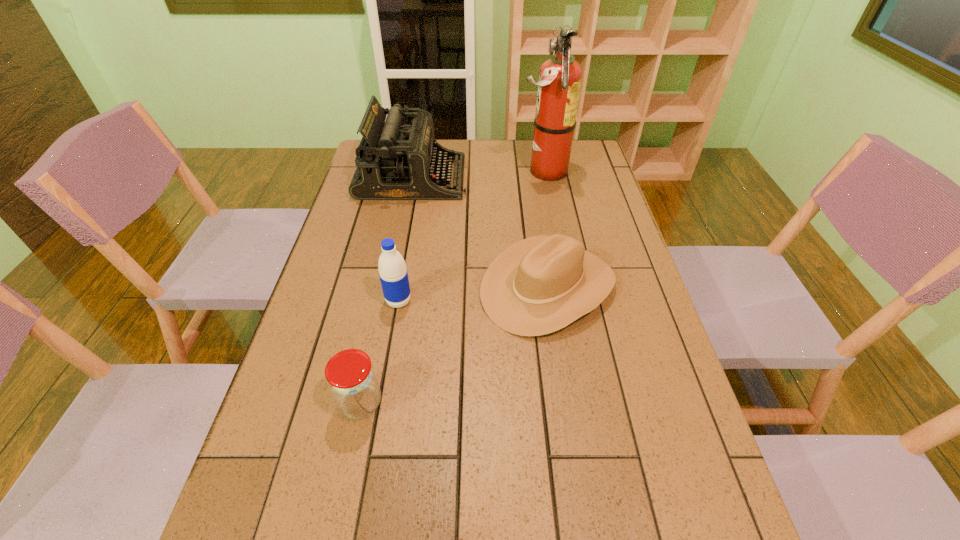
Find the location of a particular element. free point located 0.360m on the front of the cowboy hat is located at coordinates (581, 505).

You are a GUI agent. You are given a task and a screenshot of the screen. Output one action in this format:
    pyautogui.click(x=<x>, y=<y>)
    Task: Click on the vacant space situated 0.340m on the back of the nearest object
    The image size is (960, 540).
    Given the screenshot: What is the action you would take?
    pyautogui.click(x=388, y=273)

In order to click on fire extinguisher that is positioned at the far edge in this screenshot , I will do `click(560, 77)`.

Where is `typewriter that is at the far edge`? The image size is (960, 540). typewriter that is at the far edge is located at coordinates [x=396, y=160].

Locate an element on the screen. The height and width of the screenshot is (540, 960). typewriter present at the left edge is located at coordinates (396, 160).

Find the location of a particular element. jar at the left edge is located at coordinates (352, 381).

Find the location of a particular element. The width and height of the screenshot is (960, 540). fire extinguisher present at the right edge is located at coordinates (560, 77).

Locate an element on the screen. Image resolution: width=960 pixels, height=540 pixels. cowboy hat situated at the right edge is located at coordinates click(541, 284).

This screenshot has height=540, width=960. In order to click on object that is at the far left corner in this screenshot , I will do `click(396, 160)`.

The width and height of the screenshot is (960, 540). Identify the location of object that is at the far right corner. (560, 77).